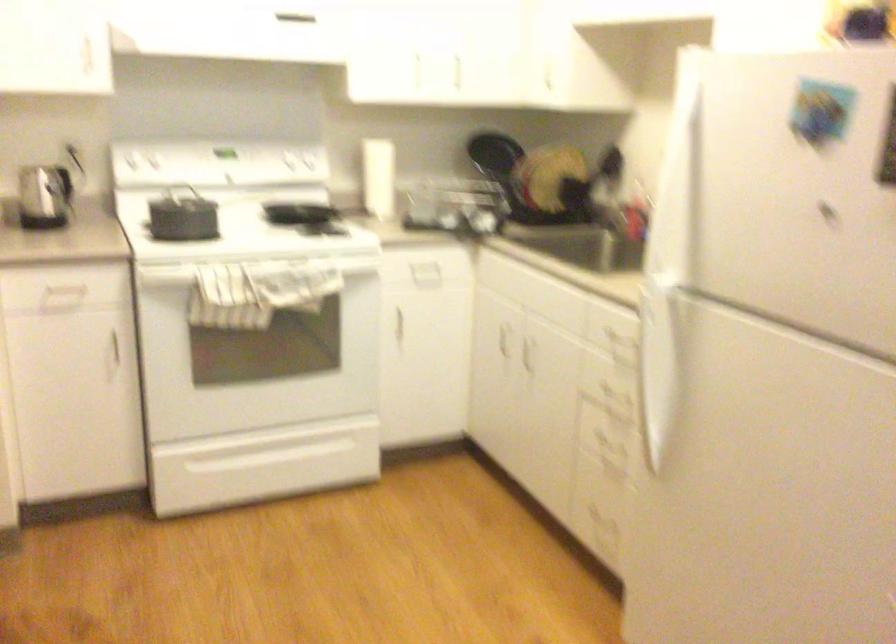
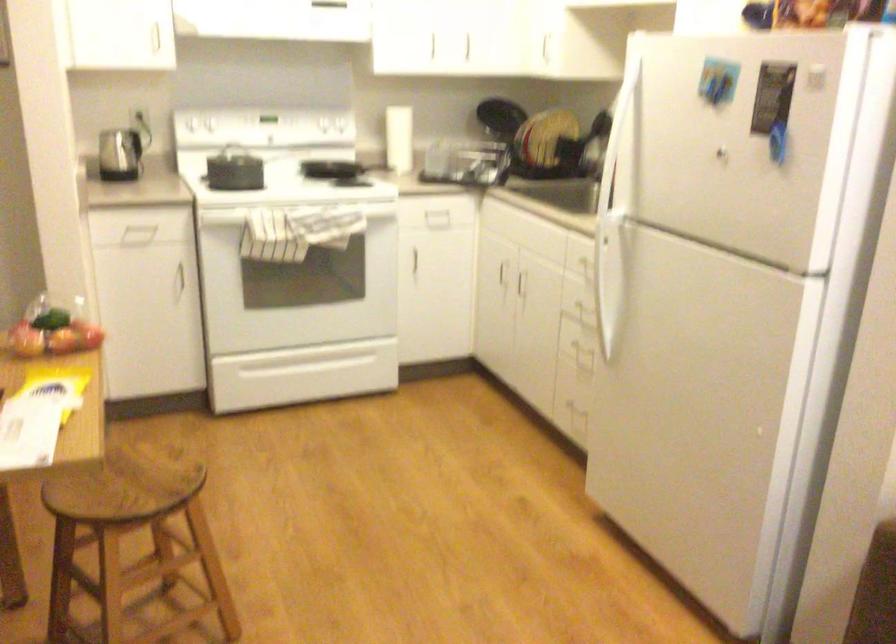
Find the pixel in the second image that matches [75,379] in the first image.

(148, 299)